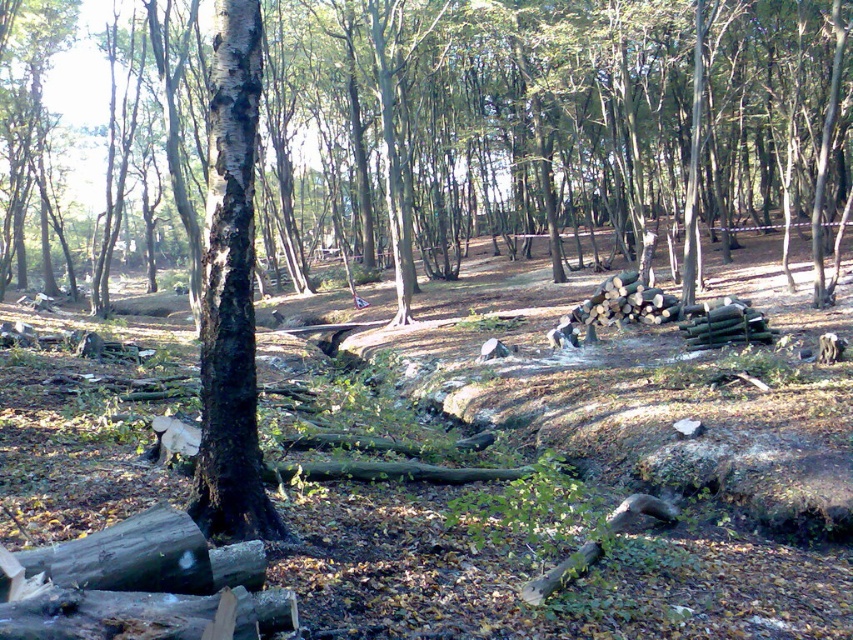
Question: Which of the following is the closest to the observer?

Choices:
 (A) (837, 202)
 (B) (212, 454)

Answer: (B)

Question: Is brown rough bark tree at center below black rough bark tree at center?

Choices:
 (A) no
 (B) yes

Answer: (A)

Question: Is brown rough bark tree at center in front of black rough bark tree at center?

Choices:
 (A) no
 (B) yes

Answer: (A)

Question: Does brown rough bark tree at center have a lesser width compared to black rough bark tree at center?

Choices:
 (A) yes
 (B) no

Answer: (B)

Question: Which point is farther from the camera taking this photo?

Choices:
 (A) (187, 240)
 (B) (230, 515)

Answer: (A)